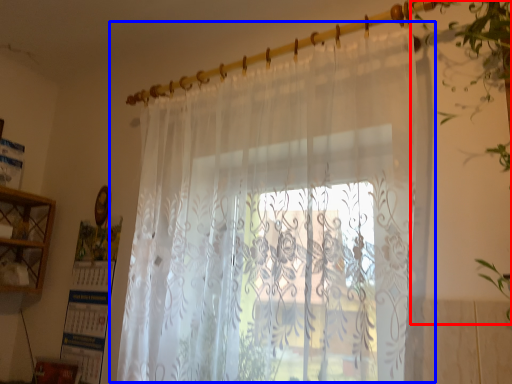
Question: Which object appears closest to the camera in this image, vegetation (highlighted by a red box) or curtain (highlighted by a blue box)?

Choices:
 (A) vegetation
 (B) curtain

Answer: (A)